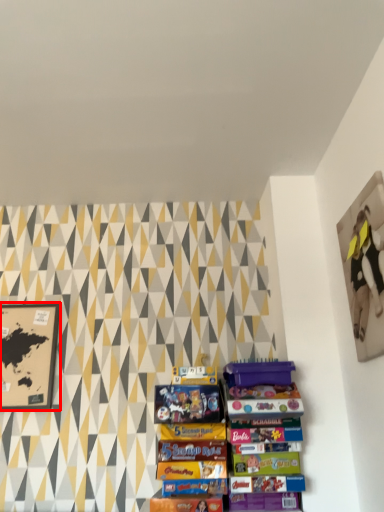
Question: From the image's perspective, what is the correct spatial positioning of picture frame (annotated by the red box) in reference to picture frame?

Choices:
 (A) above
 (B) below

Answer: (B)